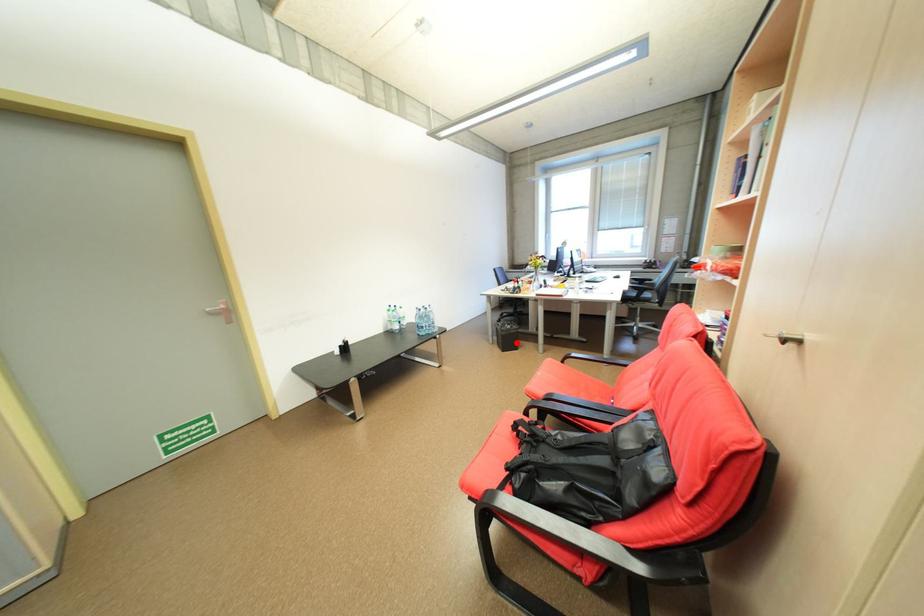
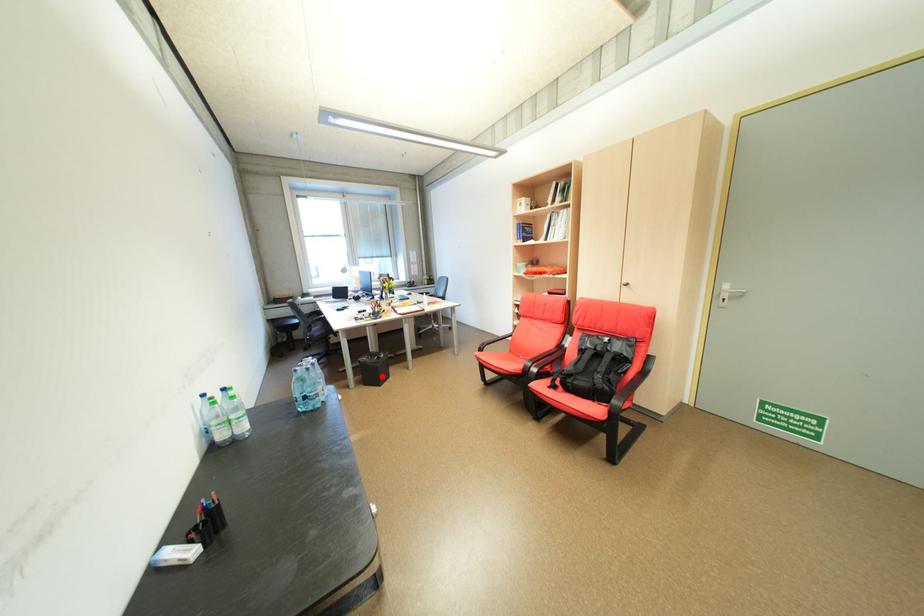
I am providing you with two images of the same scene from different viewpoints. A red point is marked on the first image and another point is marked on the second image. Does the point marked in image1 correspond to the same location as the one in image2?

Yes